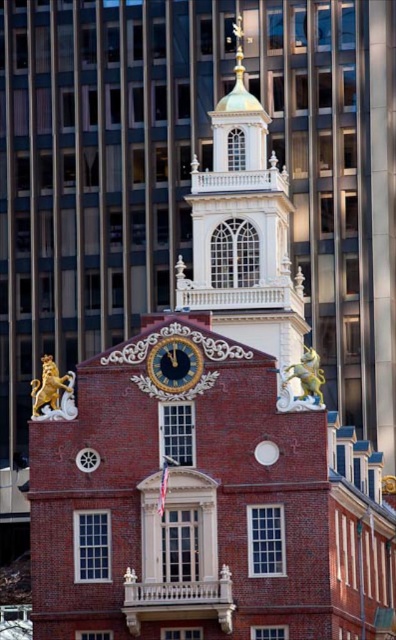
You are standing in front of the historic building and want to take a photo of both the gold metallic clock at center and the gold polished metal lion at upper left. Can you capture both in a single shot without moving your camera? Explain why or why not based on their positions.

The gold metallic clock at center is in front of the gold polished metal lion at upper left, so part of the clock will block the lion in the photo. You might need to adjust your angle or move to ensure both are visible.